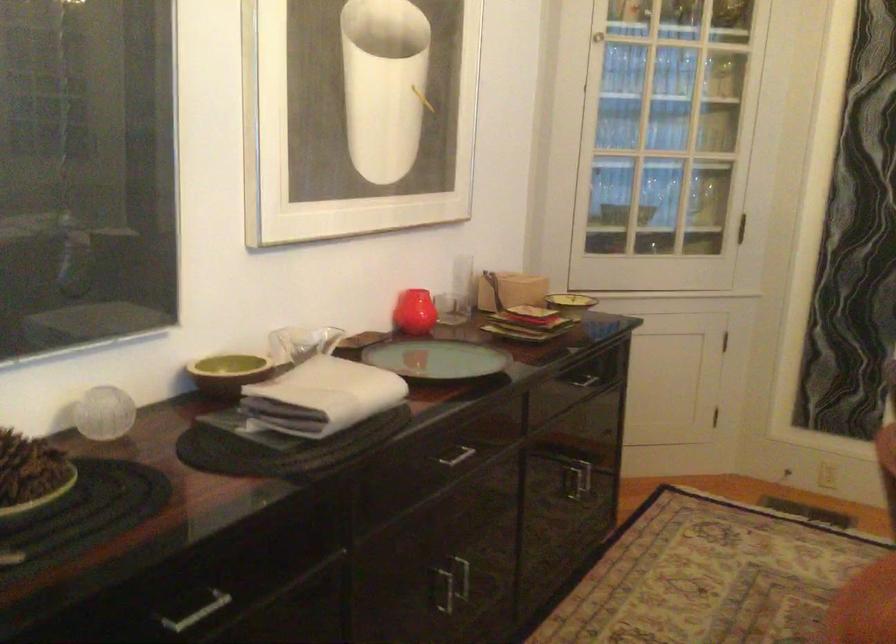
I want to click on glass water pitcher, so click(300, 343).